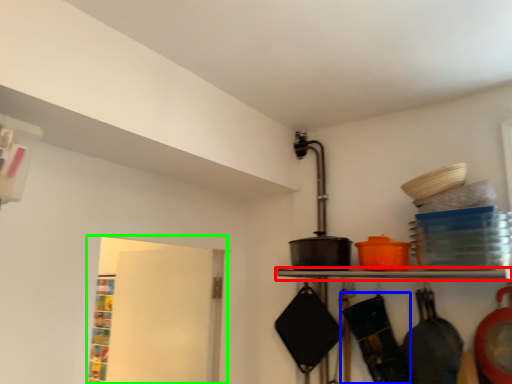
Question: Estimate the real-world distances between objects in this image. Which object is closer to shelf (highlighted by a red box), frying pan (highlighted by a blue box) or window (highlighted by a green box)?

Choices:
 (A) frying pan
 (B) window

Answer: (A)